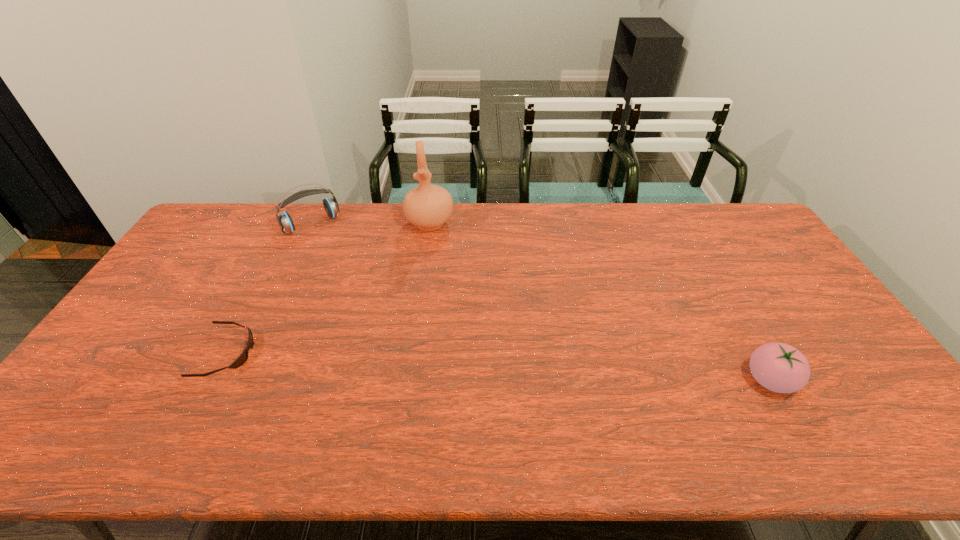
I want to click on vacant space at the right edge of the desktop, so click(800, 327).

Identify the location of vacant region between the headset and the shortest object. (269, 288).

Identify the location of vacant area that lies between the third tallest object and the headset. Image resolution: width=960 pixels, height=540 pixels. (540, 302).

Locate an element on the screen. free space between the headset and the shortest object is located at coordinates (269, 288).

This screenshot has width=960, height=540. I want to click on free spot between the pottery and the second tallest object, so click(371, 224).

Identify the location of vacant space that's between the tallest object and the sunglasses. Image resolution: width=960 pixels, height=540 pixels. (328, 288).

This screenshot has height=540, width=960. Identify the location of free spot between the sunglasses and the third shortest object. (269, 288).

Find the location of a particular element. This screenshot has width=960, height=540. free space between the tomato and the shortest object is located at coordinates (498, 367).

Where is `free space between the tomato and the sunglasses`? free space between the tomato and the sunglasses is located at coordinates (498, 367).

Where is `unoccupied area between the tallest object and the second tallest object`? The height and width of the screenshot is (540, 960). unoccupied area between the tallest object and the second tallest object is located at coordinates (371, 224).